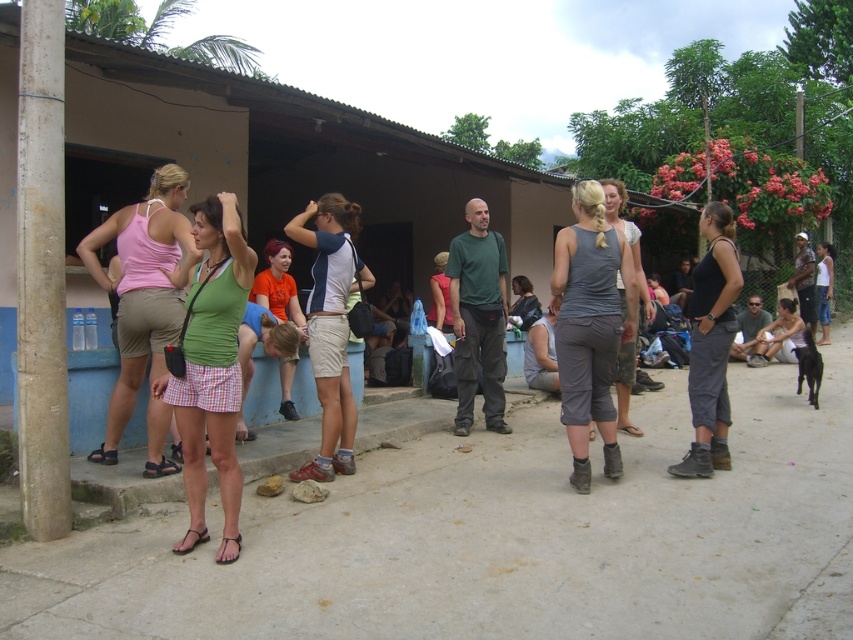
Question: Which is farther from the gray cotton shorts at center?

Choices:
 (A) green fabric shirt at center
 (B) concrete pole at left
 (C) light pink fabric shirt at center

Answer: (C)

Question: Does black fabric tank top at center have a smaller size compared to gray cotton shorts at center?

Choices:
 (A) yes
 (B) no

Answer: (B)

Question: Considering the real-world distances, which object is closest to the orange t-shirt at center?

Choices:
 (A) green fabric shirt at center
 (B) gray fabric pants at center
 (C) gray cotton shorts at center

Answer: (A)

Question: Considering the relative positions of gray fabric pants at center and matte blue and white shirt at center in the image provided, where is gray fabric pants at center located with respect to matte blue and white shirt at center?

Choices:
 (A) right
 (B) left

Answer: (A)

Question: Is black fabric tank top at center behind light pink fabric shirt at center?

Choices:
 (A) no
 (B) yes

Answer: (A)

Question: Which of the following is the farthest from the observer?

Choices:
 (A) pink fabric tank top at left
 (B) orange t-shirt at center

Answer: (B)